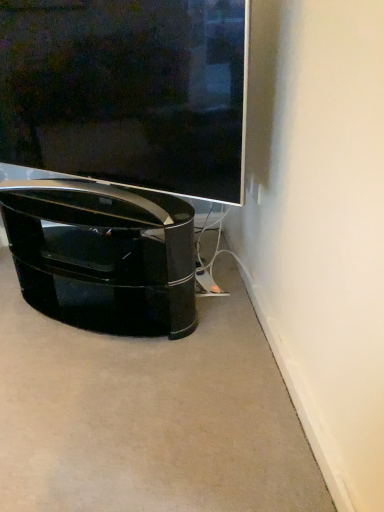
Describe the element at coordinates (128, 91) in the screenshot. I see `matte black tv at center` at that location.

Locate an element on the screen. This screenshot has height=512, width=384. matte black tv at center is located at coordinates (128, 91).

Where is `glossy black tv stand at lower left`? Image resolution: width=384 pixels, height=512 pixels. glossy black tv stand at lower left is located at coordinates (103, 255).

Describe the element at coordinates (103, 255) in the screenshot. The height and width of the screenshot is (512, 384). I see `glossy black tv stand at lower left` at that location.

Where is `matte black tv at center`? This screenshot has width=384, height=512. matte black tv at center is located at coordinates (128, 91).

Visually, is matte black tv at center positioned to the left or to the right of glossy black tv stand at lower left?

From the image, it's evident that matte black tv at center is to the right of glossy black tv stand at lower left.

Which object is more forward, matte black tv at center or glossy black tv stand at lower left?

matte black tv at center is more forward.

Which is behind, point (177, 84) or point (155, 302)?

Positioned behind is point (155, 302).

From the image's perspective, would you say matte black tv at center is shown under glossy black tv stand at lower left?

Incorrect, from the image's perspective, matte black tv at center is higher than glossy black tv stand at lower left.

Consider the image. From a real-world perspective, which object stands above the other?

matte black tv at center, from a real-world perspective.

Considering the relative sizes of matte black tv at center and glossy black tv stand at lower left in the image provided, is matte black tv at center wider than glossy black tv stand at lower left?

No.

Can you confirm if matte black tv at center is taller than glossy black tv stand at lower left?

Indeed, matte black tv at center has a greater height compared to glossy black tv stand at lower left.

Can you confirm if matte black tv at center is smaller than glossy black tv stand at lower left?

Yes.

Is glossy black tv stand at lower left located within matte black tv at center?

Definitely not — glossy black tv stand at lower left is not inside matte black tv at center.

Is matte black tv at center with glossy black tv stand at lower left?

No, matte black tv at center is not in contact with glossy black tv stand at lower left.

Could you tell me if matte black tv at center is turned towards glossy black tv stand at lower left?

No, matte black tv at center is not turned towards glossy black tv stand at lower left.

Can you tell me how much matte black tv at center and glossy black tv stand at lower left differ in facing direction?

There is a 1.19-degree angle between the facing directions of matte black tv at center and glossy black tv stand at lower left.

In the image, there is a matte black tv at center. At what (x,y) coordinates should I click in order to perform the action: click on furniture below it (from the image's perspective). Please return your answer as a coordinate pair (x, y). This screenshot has width=384, height=512. Looking at the image, I should click on (103, 255).

Based on the photo, which object is positioned more to the left, glossy black tv stand at lower left or matte black tv at center?

glossy black tv stand at lower left.

Does glossy black tv stand at lower left lie in front of matte black tv at center?

No.

Which is further, (x=160, y=269) or (x=99, y=18)?

The point (x=160, y=269) is farther from the camera.

From the image's perspective, does glossy black tv stand at lower left appear higher than matte black tv at center?

No, from the image's perspective, glossy black tv stand at lower left is not on top of matte black tv at center.

From a real-world perspective, which is physically above, glossy black tv stand at lower left or matte black tv at center?

matte black tv at center is physically above.

Is glossy black tv stand at lower left wider than matte black tv at center?

Correct, the width of glossy black tv stand at lower left exceeds that of matte black tv at center.

Which of these two, glossy black tv stand at lower left or matte black tv at center, stands taller?

matte black tv at center is taller.

Who is smaller, glossy black tv stand at lower left or matte black tv at center?

With smaller size is matte black tv at center.

Is glossy black tv stand at lower left inside or outside of matte black tv at center?

glossy black tv stand at lower left lies outside matte black tv at center.

Is glossy black tv stand at lower left not close to matte black tv at center?

No, there isn't a large distance between glossy black tv stand at lower left and matte black tv at center.

Is glossy black tv stand at lower left facing towards matte black tv at center?

No.

Where is `furniture that appears on the left of matte black tv at center`? furniture that appears on the left of matte black tv at center is located at coordinates (103, 255).

Find the location of a particular element. television in front of the glossy black tv stand at lower left is located at coordinates (128, 91).

Find the location of a particular element. The height and width of the screenshot is (512, 384). television located above the glossy black tv stand at lower left (from the image's perspective) is located at coordinates (128, 91).